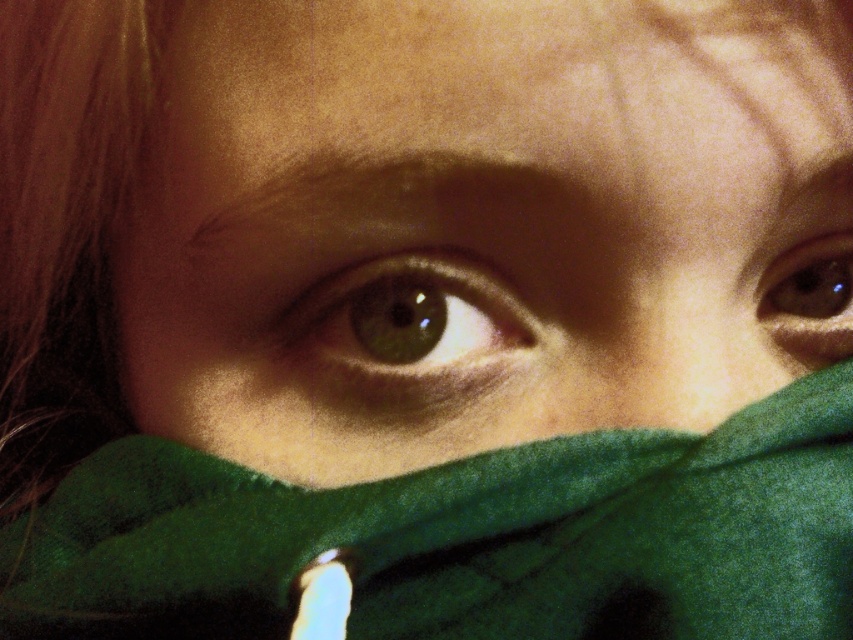
Between smooth skin nose at center and brown matte eye at upper right, which one is positioned higher?

brown matte eye at upper right is higher up.

Is smooth skin nose at center thinner than brown matte eye at upper right?

Incorrect, smooth skin nose at center's width is not less than brown matte eye at upper right's.

The image size is (853, 640). What are the coordinates of `smooth skin nose at center` in the screenshot? It's located at (665, 358).

This screenshot has height=640, width=853. Identify the location of smooth skin nose at center. (x=665, y=358).

Can you confirm if green matte eye at center is shorter than brown matte eye at upper right?

In fact, green matte eye at center may be taller than brown matte eye at upper right.

Consider the image. Who is more forward, (398,344) or (846,355)?

Point (398,344) is more forward.

Find the location of a particular element. The image size is (853, 640). green matte eye at center is located at coordinates (410, 328).

Which is behind, point (415, 280) or point (756, 368)?

The point (756, 368) is more distant.

Where is `green matte eye at center`? The height and width of the screenshot is (640, 853). green matte eye at center is located at coordinates (410, 328).

Locate an element on the screen. green matte eye at center is located at coordinates (410, 328).

What are the coordinates of `green matte eye at center` in the screenshot? It's located at [x=410, y=328].